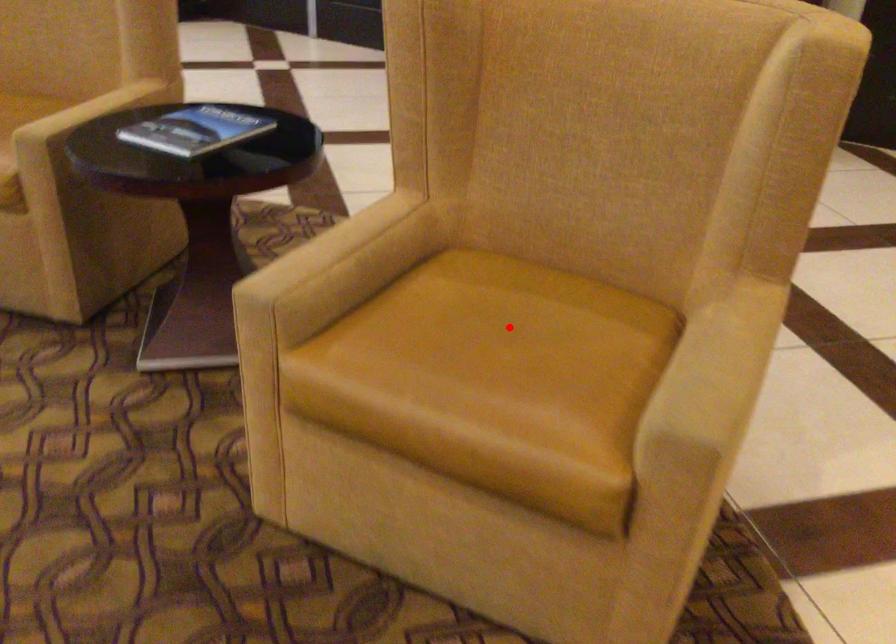
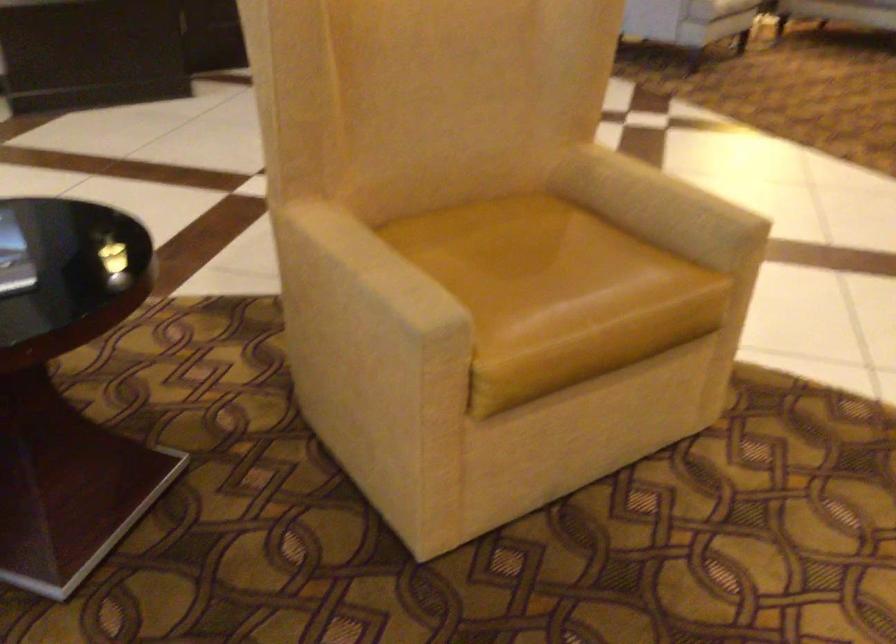
Question: I am providing you with two images of the same scene from different viewpoints. A red point is shown in image1. For the corresponding object point in image2, is it positioned nearer or farther from the camera?

Choices:
 (A) Nearer
 (B) Farther

Answer: (B)